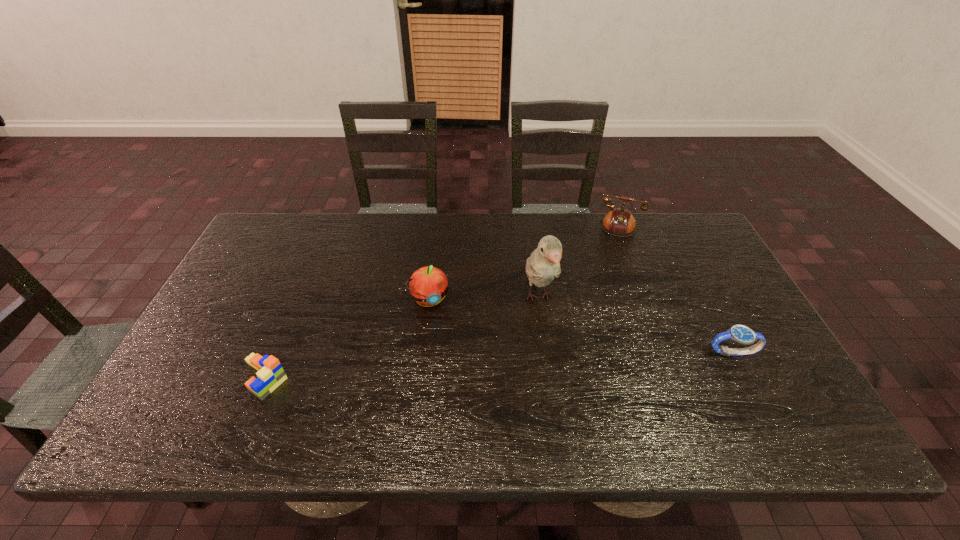
Where is `vacant region located 0.230m at the face of the third object from left to right`? This screenshot has height=540, width=960. vacant region located 0.230m at the face of the third object from left to right is located at coordinates (569, 401).

Identify the location of free space located at the face of the third object from left to right. (551, 342).

Where is `vacant space situated on the surface of the apple`? The height and width of the screenshot is (540, 960). vacant space situated on the surface of the apple is located at coordinates (466, 395).

In order to click on free region located on the surface of the apple in this screenshot , I will do `click(442, 332)`.

Where is `free space located 0.090m on the surface of the apple`? free space located 0.090m on the surface of the apple is located at coordinates (444, 337).

Find the location of a particular element. free space located 0.150m on the rotary dial of the second object from right to left is located at coordinates (578, 269).

You are a GUI agent. You are given a task and a screenshot of the screen. Output one action in this format:
    pyautogui.click(x=<x>, y=<y>)
    Task: Click on the vacant space located on the rotary dial of the second object from right to left
    
    Given the screenshot: What is the action you would take?
    pyautogui.click(x=566, y=313)

The width and height of the screenshot is (960, 540). I want to click on free location located on the rotary dial of the second object from right to left, so click(x=580, y=265).

In order to click on object present at the far edge in this screenshot , I will do `click(619, 222)`.

Identify the location of object present at the near edge. (270, 374).